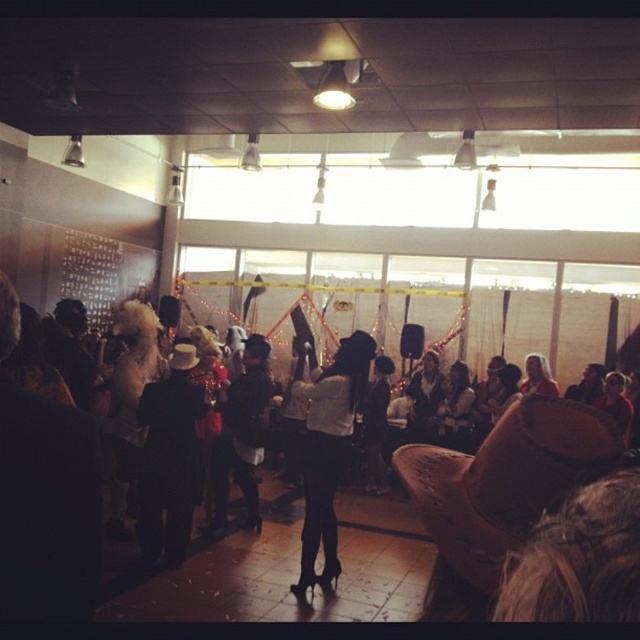
Looking at this image, you are a photographer at the party and want to capture both the black matte suit at center and the white matte jacket at center in a single frame. Which of the two requires more space to fully fit in the photo?

The white matte jacket at center requires more space because its width is greater than the black matte suit at center.